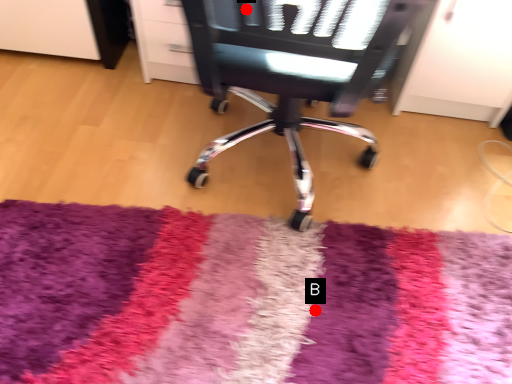
Question: Two points are circled on the image, labeled by A and B beside each circle. Which point is further to the camera?

Choices:
 (A) A is further
 (B) B is further

Answer: (B)